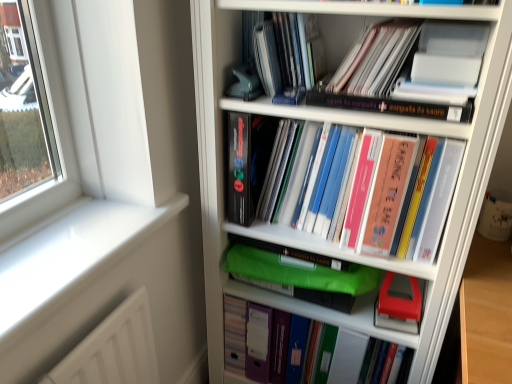
Question: Would you consider hardcover book at center, the fourth book viewed from the top, to be distant from green plastic folder at center, arranged as the 1th book when ordered from the bottom?

Choices:
 (A) yes
 (B) no

Answer: (B)

Question: From the image's perspective, is hardcover book at center, the fourth book viewed from the top, over green plastic folder at center, arranged as the 1th book when ordered from the bottom?

Choices:
 (A) yes
 (B) no

Answer: (A)

Question: Does hardcover book at center, marked as the 2th book in a bottom-to-top arrangement, turn towards green plastic folder at center, arranged as the 1th book when ordered from the bottom?

Choices:
 (A) yes
 (B) no

Answer: (B)

Question: Is hardcover book at center, the fourth book viewed from the top, bigger than green plastic folder at center, arranged as the 1th book when ordered from the bottom?

Choices:
 (A) yes
 (B) no

Answer: (A)

Question: From a real-world perspective, is hardcover book at center, the fourth book viewed from the top, located higher than green plastic folder at center, arranged as the 1th book when ordered from the bottom?

Choices:
 (A) yes
 (B) no

Answer: (A)

Question: From the image's perspective, is matte black book at upper center, placed as the fifth book when sorted from bottom to top, above or below matte pink paper at upper center, the fourth book ordered from the bottom?

Choices:
 (A) above
 (B) below

Answer: (A)

Question: Relative to matte pink paper at upper center, the fourth book ordered from the bottom, is matte black book at upper center, which is the 1th book from top to bottom, in front or behind?

Choices:
 (A) front
 (B) behind

Answer: (B)

Question: In terms of width, does matte black book at upper center, which is the 1th book from top to bottom, look wider or thinner when compared to matte pink paper at upper center, the fourth book ordered from the bottom?

Choices:
 (A) thin
 (B) wide

Answer: (A)

Question: Based on their sizes in the image, would you say matte black book at upper center, placed as the fifth book when sorted from bottom to top, is bigger or smaller than matte pink paper at upper center, the 2th book when ordered from top to bottom?

Choices:
 (A) small
 (B) big

Answer: (A)

Question: Looking at their shapes, would you say hardcover book at center, marked as the 2th book in a bottom-to-top arrangement, is wider or thinner than matte pink paper at upper center, the 2th book when ordered from top to bottom?

Choices:
 (A) wide
 (B) thin

Answer: (B)

Question: Would you say hardcover book at center, the fourth book viewed from the top, is inside or outside matte pink paper at upper center, the fourth book ordered from the bottom?

Choices:
 (A) inside
 (B) outside

Answer: (B)

Question: Is hardcover book at center, the fourth book viewed from the top, to the left or to the right of matte pink paper at upper center, the 2th book when ordered from top to bottom, in the image?

Choices:
 (A) right
 (B) left

Answer: (B)

Question: Considering their positions, is hardcover book at center, marked as the 2th book in a bottom-to-top arrangement, located in front of or behind matte pink paper at upper center, the 2th book when ordered from top to bottom?

Choices:
 (A) front
 (B) behind

Answer: (B)

Question: Is point (373, 44) positioned closer to the camera than point (317, 190)?

Choices:
 (A) closer
 (B) farther

Answer: (A)

Question: In terms of width, does matte pink paper at upper center, the 2th book when ordered from top to bottom, look wider or thinner when compared to hardcover book at center, the fourth book viewed from the top?

Choices:
 (A) thin
 (B) wide

Answer: (B)